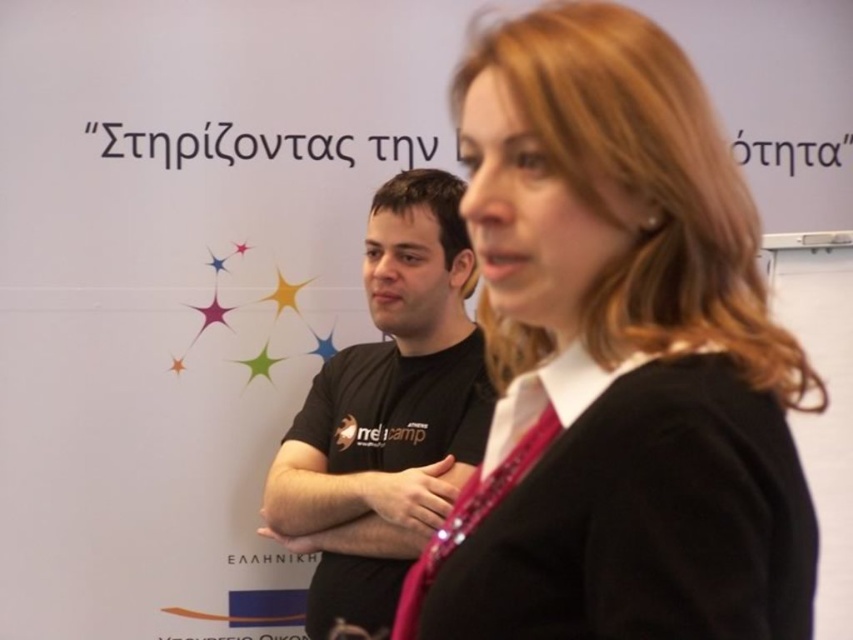
The black matte jacket at center is between two people. How far apart are the two people?

The two people are 22.12 inches apart.

Please provide the 2D coordinates of the black matte jacket at center in the image, using the coordinate system where the bottom left corner is the origin point.

The black matte jacket at center is located at coordinates 0.562 on the x axis and 0.728 on the y axis.